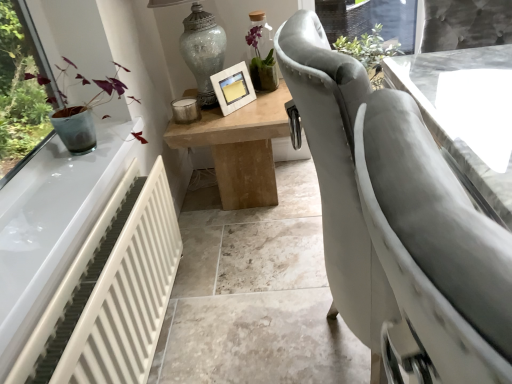
I want to click on spots to the right of white textured picture frame at center, so click(264, 106).